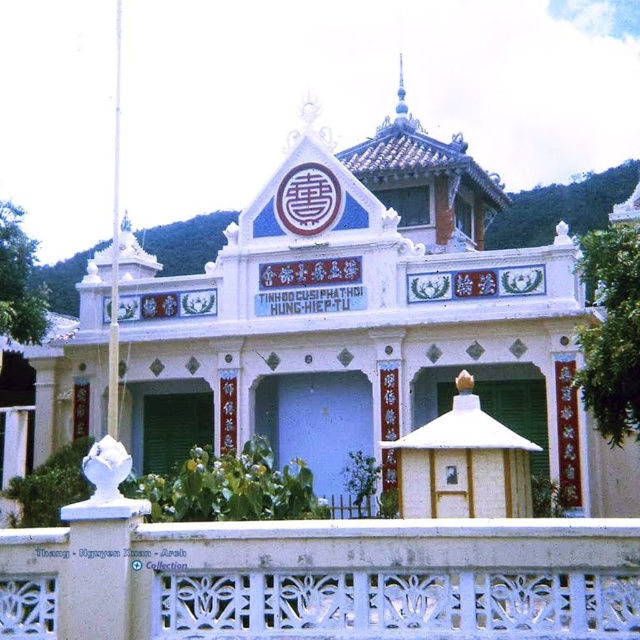
Question: Can you confirm if white painted wood palace at center is positioned to the left of white carved stone balustrade at lower center?

Choices:
 (A) yes
 (B) no

Answer: (A)

Question: Which of the following is the closest to the observer?

Choices:
 (A) white carved stone balustrade at lower center
 (B) white painted wood palace at center

Answer: (A)

Question: Among these points, which one is nearest to the camera?

Choices:
 (A) (99, 404)
 (B) (243, 570)

Answer: (B)

Question: Considering the relative positions of white painted wood palace at center and white carved stone balustrade at lower center in the image provided, where is white painted wood palace at center located with respect to white carved stone balustrade at lower center?

Choices:
 (A) right
 (B) left

Answer: (B)

Question: Can you confirm if white painted wood palace at center is wider than white carved stone balustrade at lower center?

Choices:
 (A) yes
 (B) no

Answer: (A)